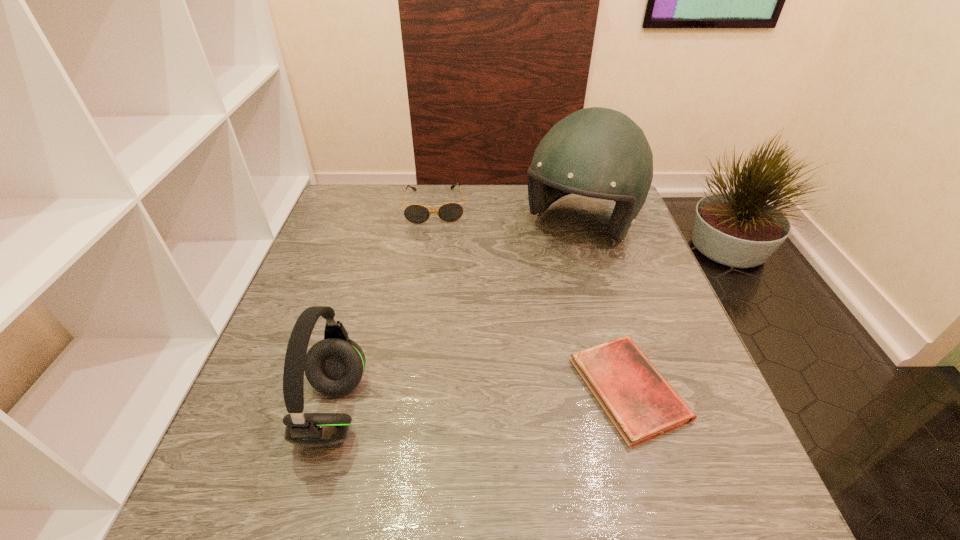
This screenshot has width=960, height=540. I want to click on vacant area between the diary and the sunglasses, so click(532, 298).

Where is `free area in between the shortest object and the third tallest object`? The image size is (960, 540). free area in between the shortest object and the third tallest object is located at coordinates (532, 298).

Locate an element on the screen. vacant point located between the diary and the headset is located at coordinates (481, 400).

Find the location of a particular element. empty space that is in between the football helmet and the sunglasses is located at coordinates (508, 217).

Where is `vacant space that is in between the sunglasses and the tallest object`? The image size is (960, 540). vacant space that is in between the sunglasses and the tallest object is located at coordinates (508, 217).

Where is `free point between the shortest object and the headset`? free point between the shortest object and the headset is located at coordinates (481, 400).

Where is `free point between the second shortest object and the football helmet`? This screenshot has width=960, height=540. free point between the second shortest object and the football helmet is located at coordinates (508, 217).

This screenshot has height=540, width=960. What are the coordinates of `vacant area that lies between the second tallest object and the tallest object` in the screenshot? It's located at (457, 319).

Identify which object is located as the third nearest to the diary. Please provide its 2D coordinates. Your answer should be formatted as a tuple, i.e. [(x, y)], where the tuple contains the x and y coordinates of a point satisfying the conditions above.

[(449, 212)]

Locate which object is the second closest to the sunglasses. Please provide its 2D coordinates. Your answer should be formatted as a tuple, i.e. [(x, y)], where the tuple contains the x and y coordinates of a point satisfying the conditions above.

[(641, 404)]